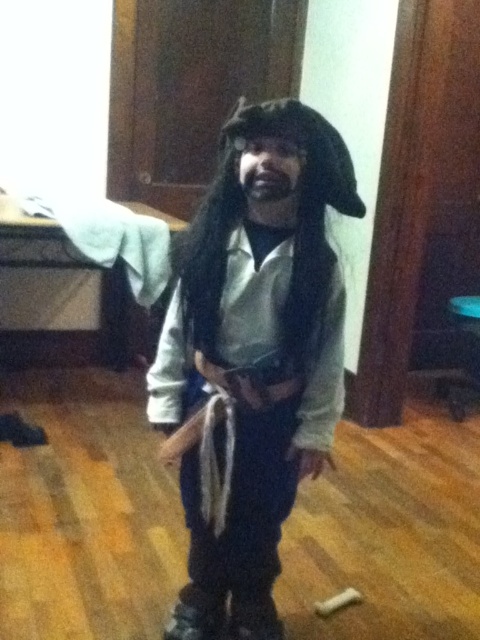
Question: Does white matte pirate costume at center have a larger size compared to dark brown hair at center?

Choices:
 (A) no
 (B) yes

Answer: (B)

Question: Which object is closer to the camera taking this photo?

Choices:
 (A) white matte pirate costume at center
 (B) dark brown hair at center

Answer: (B)

Question: Is white matte pirate costume at center above dark brown hair at center?

Choices:
 (A) yes
 (B) no

Answer: (B)

Question: Observing the image, what is the correct spatial positioning of white matte pirate costume at center in reference to dark brown hair at center?

Choices:
 (A) below
 (B) above

Answer: (A)

Question: Which point is farther to the camera?

Choices:
 (A) dark brown hair at center
 (B) white matte pirate costume at center

Answer: (B)